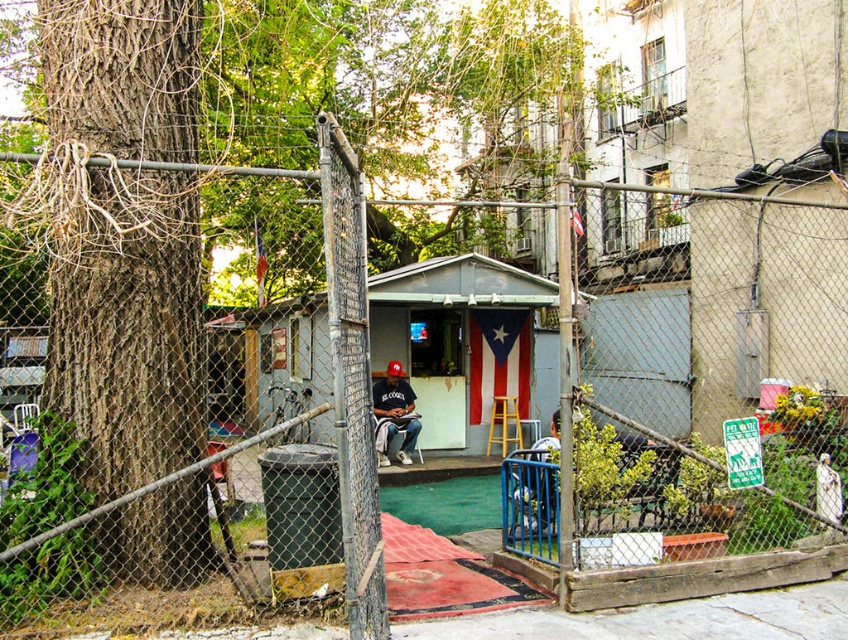
Is matte black shirt at center thinner than yellow wood stool at center?

Indeed, matte black shirt at center has a lesser width compared to yellow wood stool at center.

Based on the photo, between matte black shirt at center and yellow wood stool at center, which one has less height?

Standing shorter between the two is matte black shirt at center.

At what (x,y) coordinates should I click in order to perform the action: click on matte black shirt at center. Please return your answer as a coordinate pair (x, y). Image resolution: width=848 pixels, height=640 pixels. Looking at the image, I should click on (534, 497).

Between matte black cap at center and yellow wood stool at center, which one is positioned higher?

Positioned higher is matte black cap at center.

Who is positioned more to the left, matte black cap at center or yellow wood stool at center?

matte black cap at center is more to the left.

Where is `matte black cap at center`? The height and width of the screenshot is (640, 848). matte black cap at center is located at coordinates coord(394,413).

Does brown rough bark tree at left appear on the left side of matte black cap at center?

Correct, you'll find brown rough bark tree at left to the left of matte black cap at center.

Is brown rough bark tree at left wider than matte black cap at center?

Yes, brown rough bark tree at left is wider than matte black cap at center.

Where is `brown rough bark tree at left`? The width and height of the screenshot is (848, 640). brown rough bark tree at left is located at coordinates (123, 236).

This screenshot has height=640, width=848. I want to click on brown rough bark tree at left, so click(123, 236).